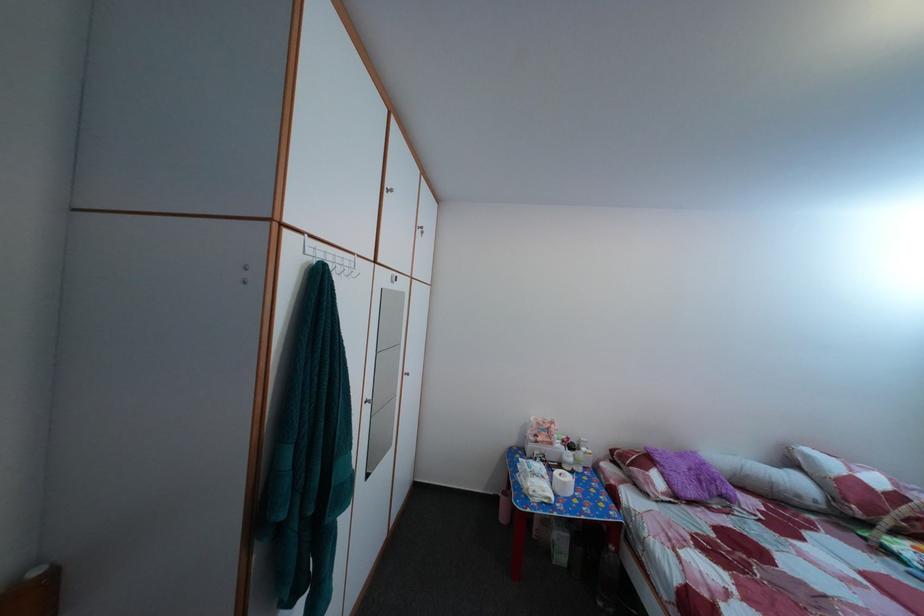
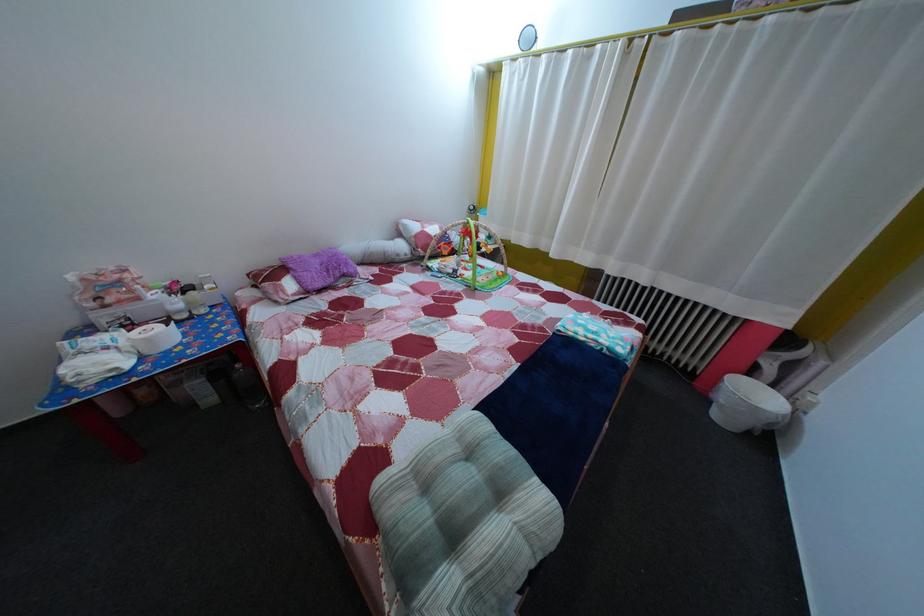
Locate, in the second image, the point that corresponds to (x=593, y=456) in the first image.

(216, 294)